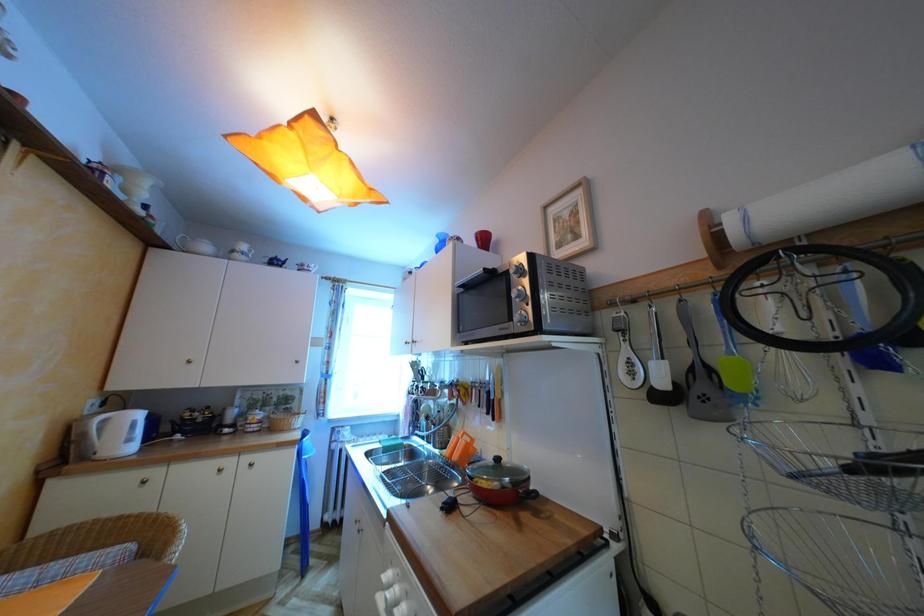
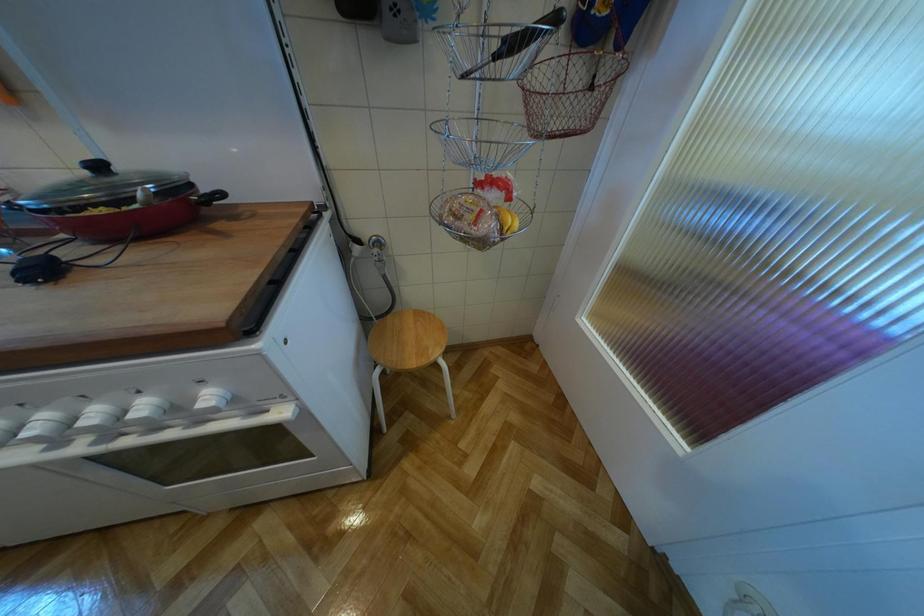
Based on the continuous images, in which direction is the camera rotating?

The camera rotated toward right-down.